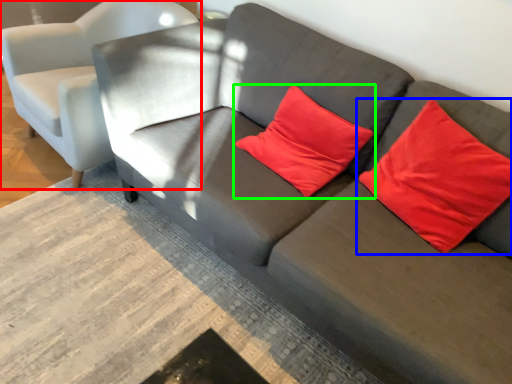
Question: Considering the real-world distances, which object is closest to chair (highlighted by a red box)? pillow (highlighted by a blue box) or pillow (highlighted by a green box).

Choices:
 (A) pillow
 (B) pillow

Answer: (B)